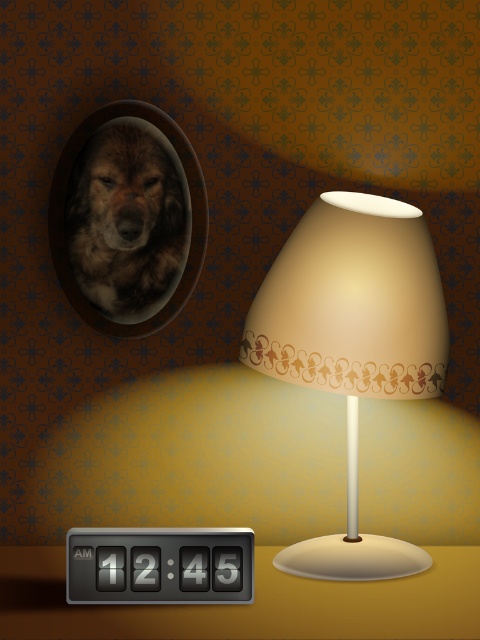
Question: Can you confirm if matte beige lampshade at center is positioned to the right of black plastic thermostat at bottom left?

Choices:
 (A) no
 (B) yes

Answer: (B)

Question: From the image, what is the correct spatial relationship of fuzzy brown dog at upper left in relation to black plastic thermostat at bottom left?

Choices:
 (A) below
 (B) above

Answer: (B)

Question: Which point is closer to the camera?

Choices:
 (A) matte beige lampshade at center
 (B) black plastic thermostat at bottom left

Answer: (B)

Question: Which object is the farthest from the matte beige lampshade at center?

Choices:
 (A) fuzzy brown dog at upper left
 (B) black plastic thermostat at bottom left

Answer: (A)

Question: From the image, what is the correct spatial relationship of matte beige lampshade at center in relation to fuzzy brown dog at upper left?

Choices:
 (A) right
 (B) left

Answer: (A)

Question: Which object is farther from the camera taking this photo?

Choices:
 (A) fuzzy brown dog at upper left
 (B) matte beige lampshade at center
 (C) black plastic thermostat at bottom left

Answer: (A)